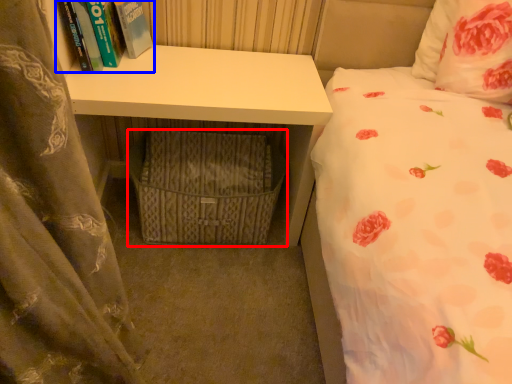
Question: Which point is further to the camera, crate (highlighted by a red box) or book (highlighted by a blue box)?

Choices:
 (A) crate
 (B) book

Answer: (A)